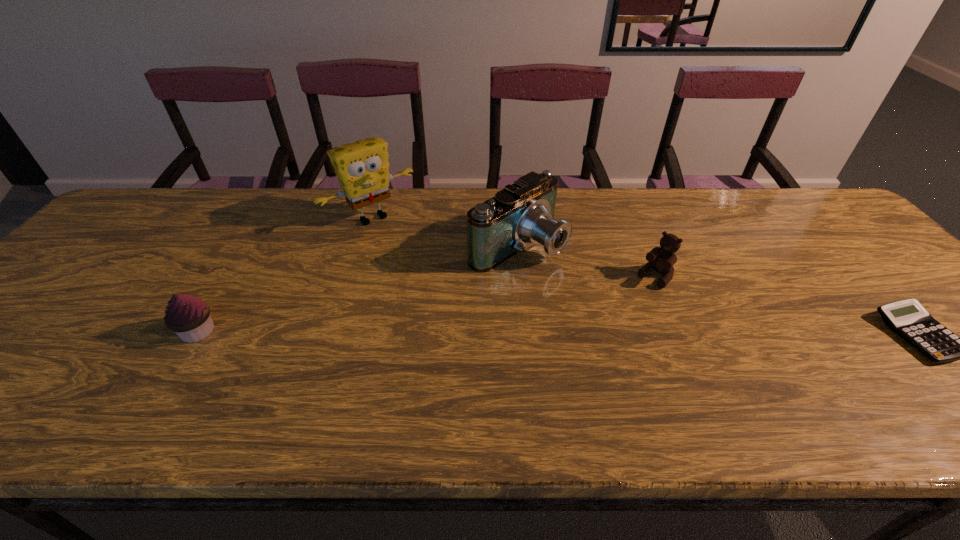
Select which object appears as the closest to the teddy bear. Please provide its 2D coordinates. Your answer should be formatted as a tuple, i.e. [(x, y)], where the tuple contains the x and y coordinates of a point satisfying the conditions above.

[(522, 213)]

At what (x,y) coordinates should I click in order to perform the action: click on vacant space that satisfies the following two spatial constraints: 1. on the back side of the leftmost object; 2. on the right side of the tallest object. Please return your answer as a coordinate pair (x, y). This screenshot has height=540, width=960. Looking at the image, I should click on (267, 217).

Identify the location of vacant space that satisfies the following two spatial constraints: 1. on the front side of the teddy bear; 2. on the right side of the second object from left to right. (353, 277).

I want to click on vacant space that satisfies the following two spatial constraints: 1. on the back side of the leftmost object; 2. on the right side of the second object from left to right, so click(x=267, y=217).